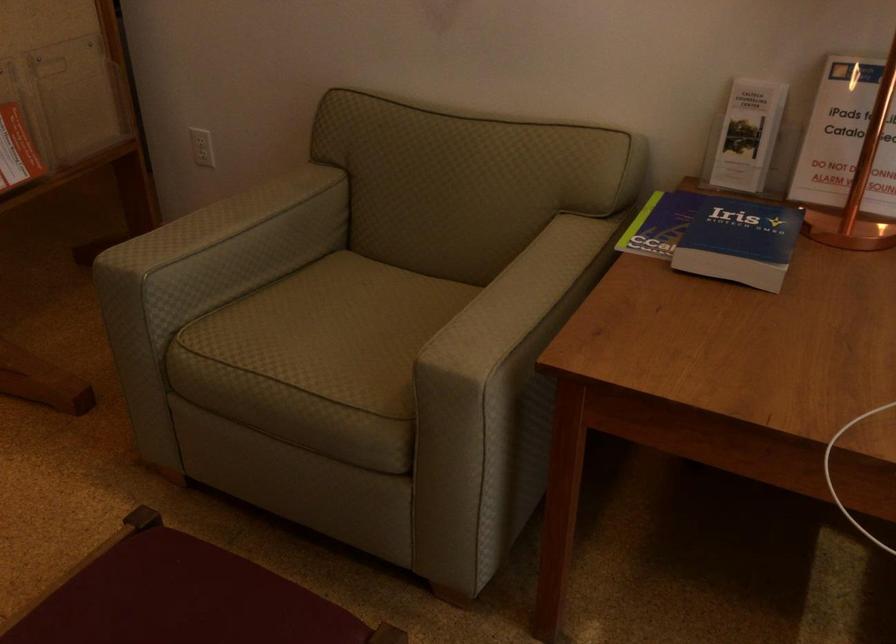
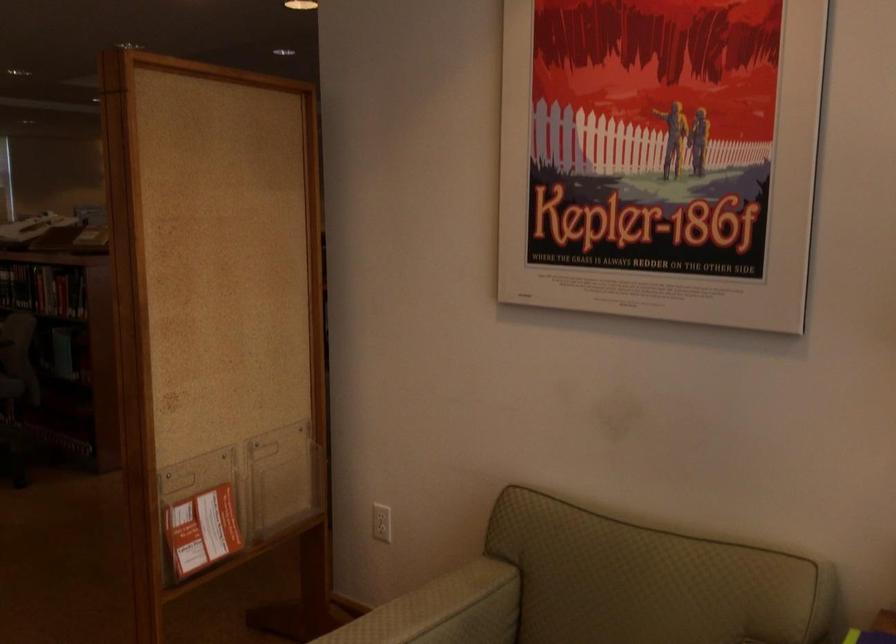
Question: Which direction would the cameraman need to move to produce the second image? Reply with the corresponding letter.

Choices:
 (A) Left
 (B) Right
 (C) Forward
 (D) Backward

Answer: (D)